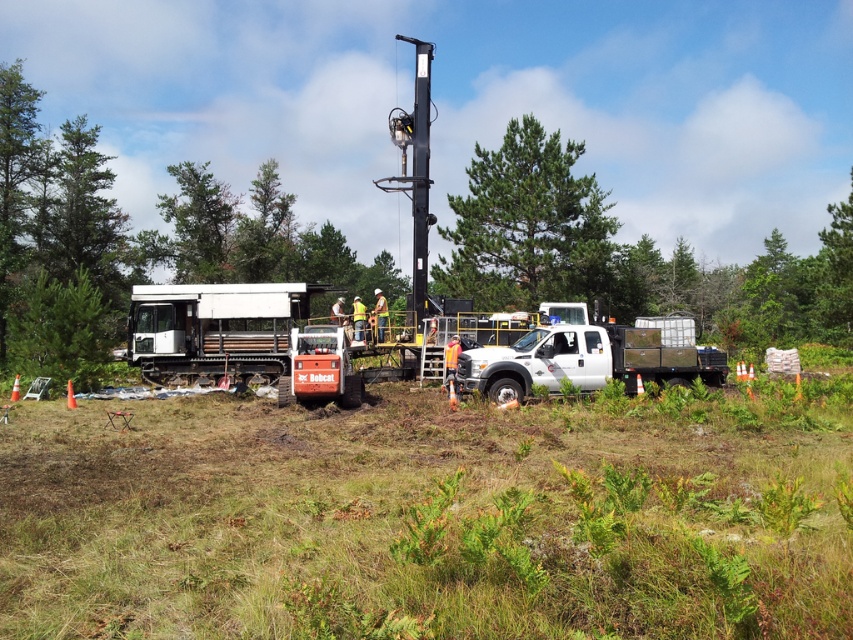
Question: Which point appears farthest from the camera in this image?

Choices:
 (A) (190, 353)
 (B) (672, 317)
 (C) (224, 246)
 (D) (556, 180)

Answer: (C)

Question: Which is farther from the green leafy tree at center?

Choices:
 (A) green leafy tree at upper center
 (B) white matte truck at center
 (C) white matte trailer truck at center

Answer: (A)

Question: Is the position of white matte trailer truck at center more distant than that of green leafy tree at upper center?

Choices:
 (A) no
 (B) yes

Answer: (A)

Question: Is green leafy tree at center positioned behind green leafy tree at upper center?

Choices:
 (A) no
 (B) yes

Answer: (A)

Question: Among these objects, which one is nearest to the camera?

Choices:
 (A) green leafy tree at upper center
 (B) white matte trailer truck at center
 (C) white matte truck at center

Answer: (C)

Question: Does white matte trailer truck at center have a smaller size compared to white matte truck at center?

Choices:
 (A) no
 (B) yes

Answer: (A)